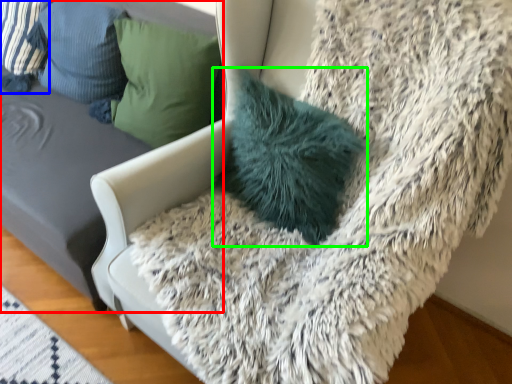
Question: Which is nearer to the furniture (highlighted by a red box)? pillow (highlighted by a blue box) or pillow (highlighted by a green box).

Choices:
 (A) pillow
 (B) pillow

Answer: (A)